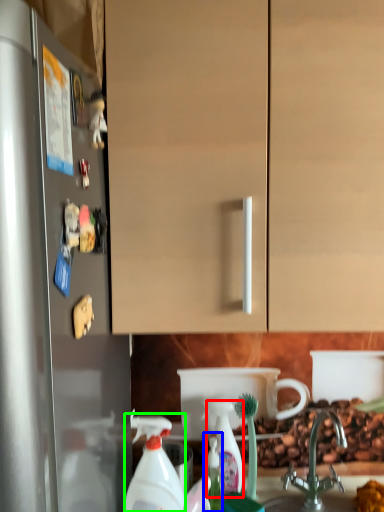
Question: Which is nearer to the cleaning product (highlighted by a red box)? bottle (highlighted by a blue box) or cleaning product (highlighted by a green box).

Choices:
 (A) bottle
 (B) cleaning product

Answer: (A)